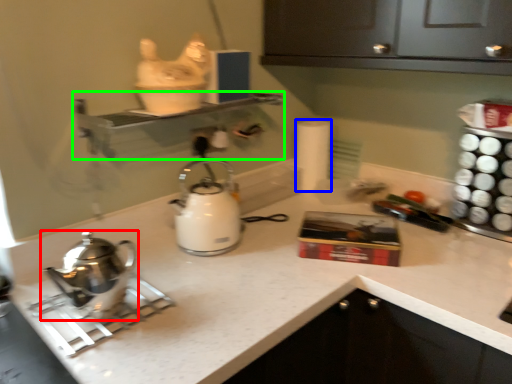
Question: Which is farther away from kettle (highlighted by a red box)? toilet paper (highlighted by a blue box) or shelf (highlighted by a green box)?

Choices:
 (A) toilet paper
 (B) shelf

Answer: (A)